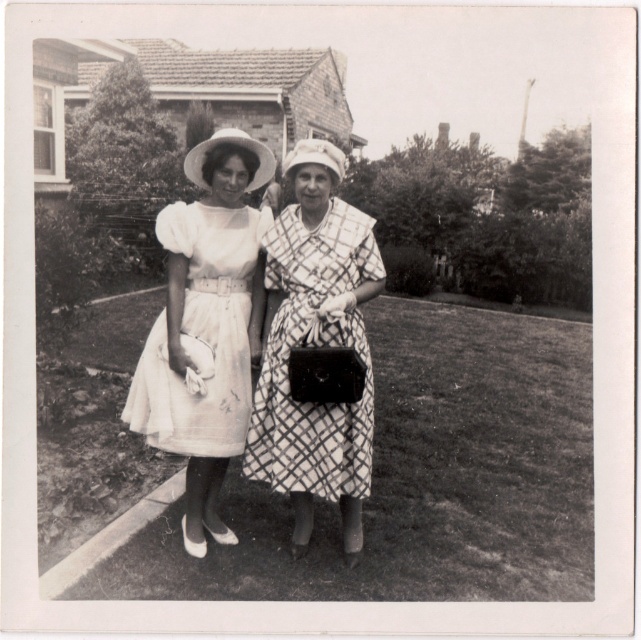
Is point (322, 241) closer to camera compared to point (212, 403)?

Yes.

Is the position of patterned fabric dress at center more distant than that of white tulle dress at center?

No, it is not.

Is point (272, 387) more distant than point (156, 358)?

No, (272, 387) is in front of (156, 358).

This screenshot has width=641, height=640. What are the coordinates of `patterned fabric dress at center` in the screenshot? It's located at (317, 344).